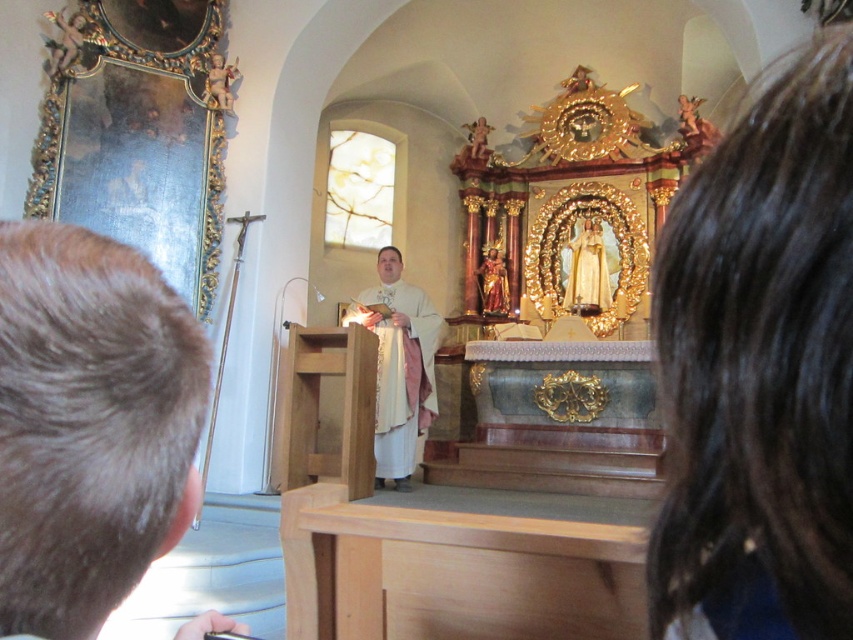
You are a photographer in the church and want to capture a photo of the altar. You notice two people with dark brown hair at upper right and brown hair at left. Which person is blocking your view of the statue?

The dark brown hair at upper right is blocking the view of the statue because it has a greater height compared to the brown hair at left.

You are a photographer taking a picture of the church interior. You notice the dark brown hair at upper right and the white cloth at center. Which object should you focus on first to ensure both are in sharp focus?

You should focus on the dark brown hair at upper right first because it is closer to the viewer than the white cloth at center. By focusing on the closer object, the depth of field may help keep the farther object in focus as well.